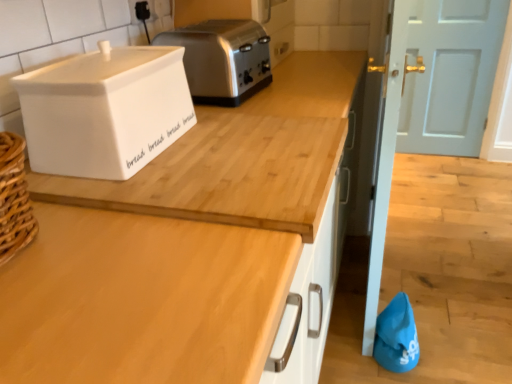
Question: Is light blue painted wood door at upper right wider or thinner than satin silver toaster at upper center?

Choices:
 (A) thin
 (B) wide

Answer: (A)

Question: From their relative heights in the image, would you say light blue painted wood door at upper right is taller or shorter than satin silver toaster at upper center?

Choices:
 (A) short
 (B) tall

Answer: (B)

Question: Estimate the real-world distances between objects in this image. Which object is closer to the wooden at upper center?

Choices:
 (A) light blue painted wood door at upper right
 (B) satin silver toaster at upper center
 (C) white ceramic bread bin at upper left

Answer: (C)

Question: Considering the real-world distances, which object is closest to the white ceramic bread bin at upper left?

Choices:
 (A) light blue painted wood door at upper right
 (B) wooden at upper center
 (C) satin silver toaster at upper center

Answer: (B)